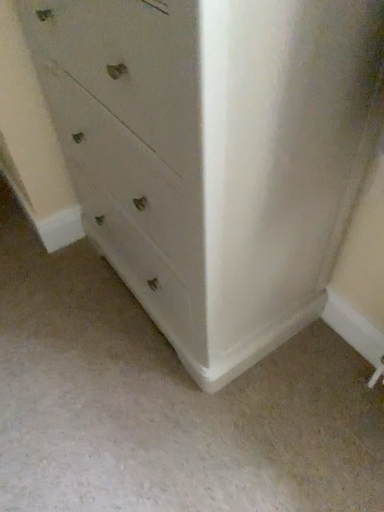
Describe the element at coordinates (215, 154) in the screenshot. I see `white wood chest of drawers at center` at that location.

You are a GUI agent. You are given a task and a screenshot of the screen. Output one action in this format:
    pyautogui.click(x=<x>, y=<y>)
    Task: Click on the white wood chest of drawers at center
    Image resolution: width=384 pixels, height=512 pixels.
    Given the screenshot: What is the action you would take?
    pyautogui.click(x=215, y=154)

Find the location of a particular element. This screenshot has height=512, width=384. white wood chest of drawers at center is located at coordinates (215, 154).